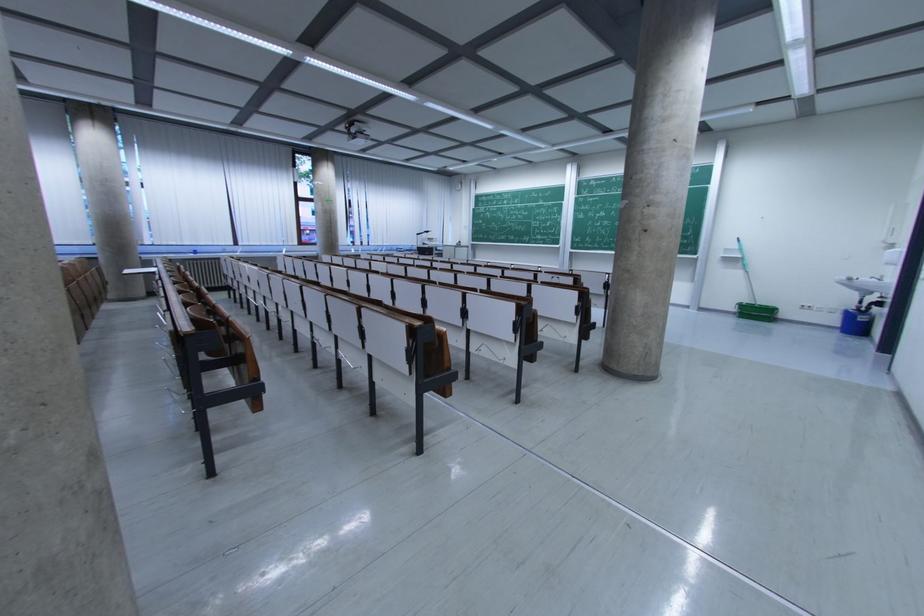
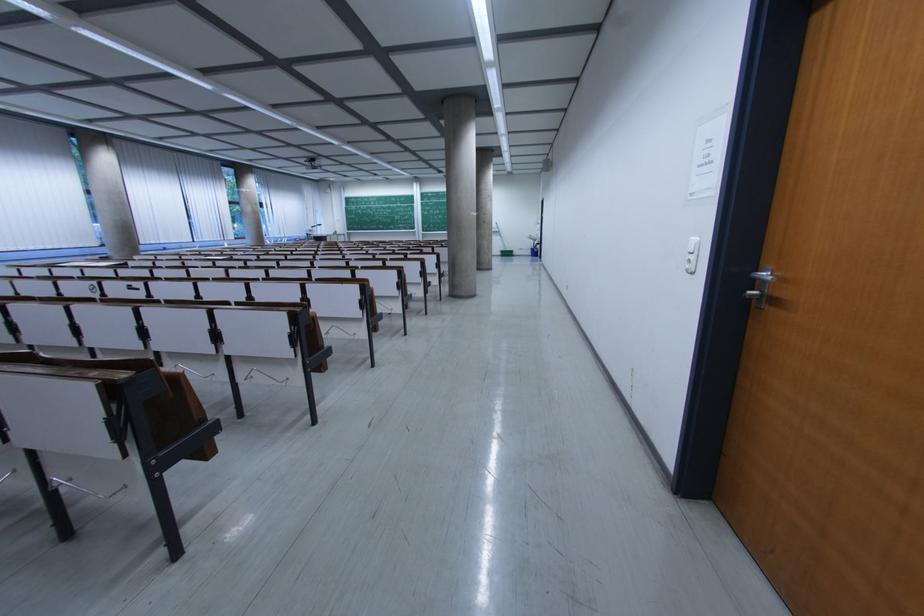
Where in the second image is the point corresponding to (750,304) from the first image?

(506, 252)